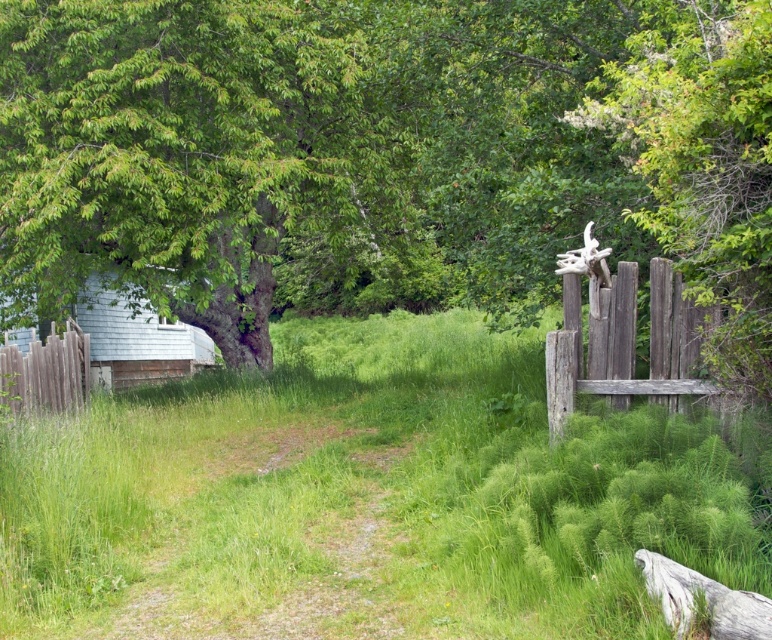
Does white wood hut at left have a smaller size compared to gray rough log at lower right?

No, white wood hut at left is not smaller than gray rough log at lower right.

Does point (107, 280) come closer to viewer compared to point (682, 628)?

No, (107, 280) is behind (682, 628).

The width and height of the screenshot is (772, 640). I want to click on white wood hut at left, so click(134, 339).

Does point (119, 312) come behind point (15, 412)?

Yes, it is.

Who is more forward, (49, 326) or (87, 355)?

Positioned in front is point (87, 355).

Describe the element at coordinates (134, 339) in the screenshot. The height and width of the screenshot is (640, 772). I see `white wood hut at left` at that location.

Where is `white wood hut at left`? The height and width of the screenshot is (640, 772). white wood hut at left is located at coordinates (134, 339).

Can you confirm if green leafy tree at upper left is shorter than white wood hut at left?

No, green leafy tree at upper left is not shorter than white wood hut at left.

Does green leafy tree at upper left appear on the left side of white wood hut at left?

Incorrect, green leafy tree at upper left is not on the left side of white wood hut at left.

Where is `green leafy tree at upper left`? The image size is (772, 640). green leafy tree at upper left is located at coordinates (384, 157).